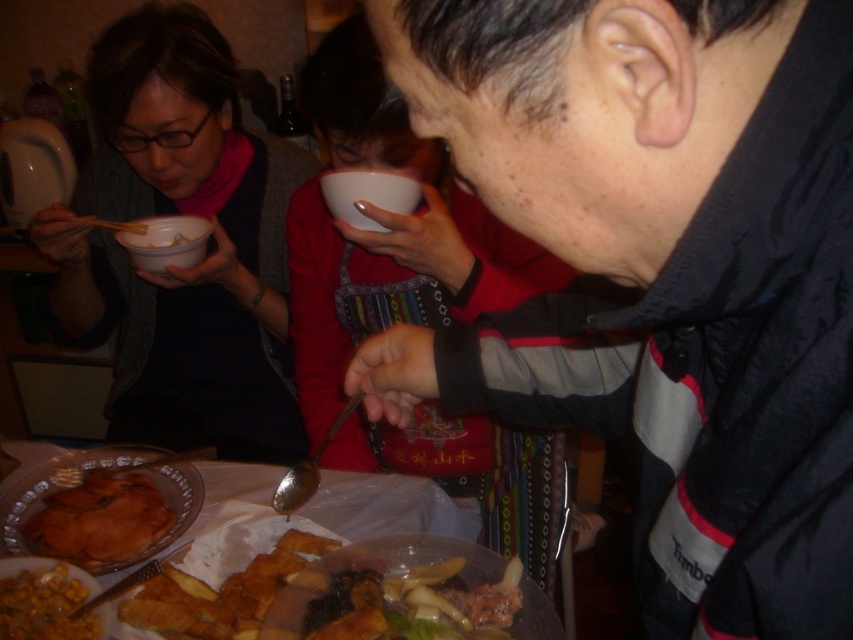
Question: Based on their relative distances, which object is farther from the yellowish matte fried food at lower left?

Choices:
 (A) white matte bowl at upper center
 (B) white matte bowl at upper left
 (C) matte black sweater at left
 (D) translucent glass plate at lower left

Answer: (C)

Question: Is translucent glass plate at lower left below brown matte fried pastry at lower left?

Choices:
 (A) yes
 (B) no

Answer: (A)

Question: Is the position of translucent glass plate at lower left more distant than that of white matte bowl at upper center?

Choices:
 (A) no
 (B) yes

Answer: (A)

Question: Which object is farther from the camera taking this photo?

Choices:
 (A) brown matte fried pastry at lower left
 (B) matte black sweater at left

Answer: (B)

Question: Which object is positioned farthest from the brown matte fried pastry at lower left?

Choices:
 (A) white matte bowl at upper left
 (B) translucent glass plate at lower left
 (C) black matte jacket at upper right
 (D) yellowish matte fried food at lower left

Answer: (C)

Question: Is black matte jacket at upper right wider than yellowish matte fried food at lower left?

Choices:
 (A) yes
 (B) no

Answer: (A)